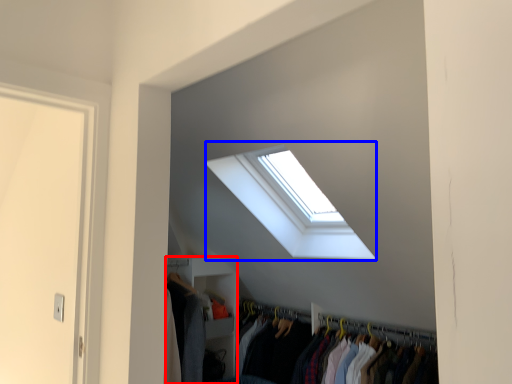
Question: Which point is closer to the camera, closet (highlighted by a red box) or window (highlighted by a blue box)?

Choices:
 (A) closet
 (B) window

Answer: (B)